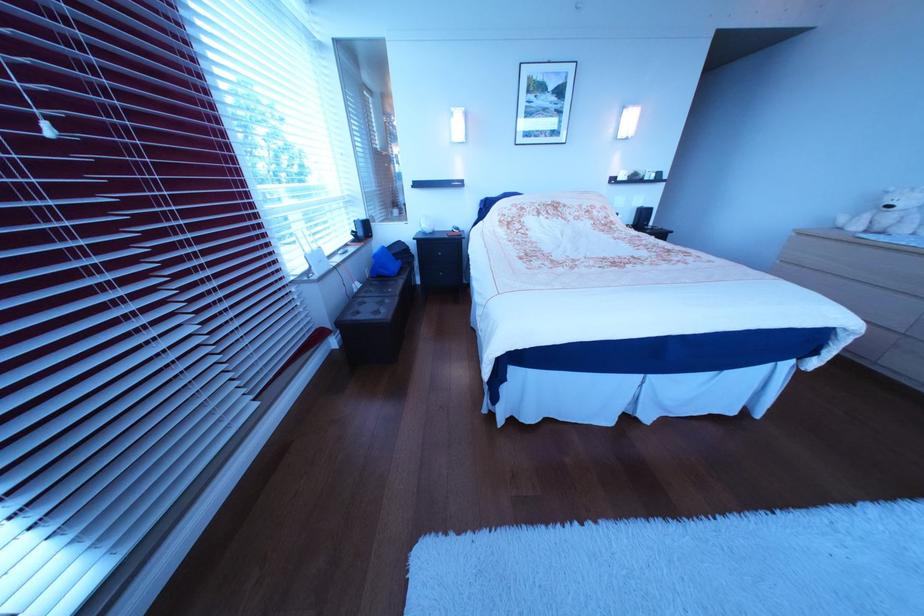
Where would you pull the white blind cord? Please return your answer as a coordinate pair (x, y).

(55, 129)